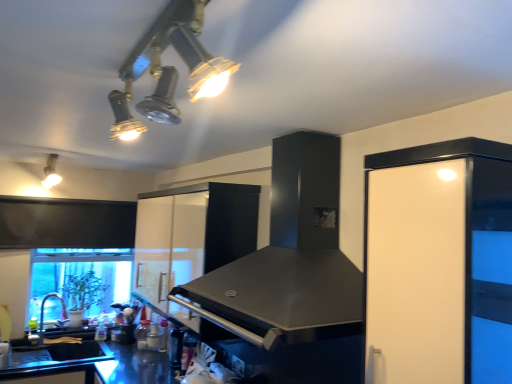
Describe the element at coordinates (42, 311) in the screenshot. I see `brushed metal faucet at lower left` at that location.

At what (x,y) coordinates should I click in order to perform the action: click on metallic track lights at upper center, the 1th light fixture when ordered from front to back. Please return your answer as a coordinate pair (x, y). The image size is (512, 384). Looking at the image, I should click on (168, 68).

I want to click on white glossy cabinet at center, positioned as the second cabinetry in front-to-back order, so click(190, 239).

Describe the element at coordinates (80, 276) in the screenshot. The width and height of the screenshot is (512, 384). I see `transparent glass window screen at lower left` at that location.

Locate an element on the screen. This screenshot has width=512, height=384. black matte sink at lower left is located at coordinates (60, 355).

In terms of width, does black matte sink at lower left look wider or thinner when compared to metallic track lights at upper center, the 1th light fixture when ordered from front to back?

black matte sink at lower left is thinner than metallic track lights at upper center, the 1th light fixture when ordered from front to back.

Looking at this image, considering the sizes of objects black matte sink at lower left and metallic track lights at upper center, which appears as the 1th light fixture when viewed from the right, in the image provided, who is taller, black matte sink at lower left or metallic track lights at upper center, which appears as the 1th light fixture when viewed from the right,?

black matte sink at lower left is taller.

Does black matte sink at lower left have a larger size compared to metallic track lights at upper center, the 1th light fixture when ordered from front to back?

Yes, black matte sink at lower left is bigger than metallic track lights at upper center, the 1th light fixture when ordered from front to back.

How different are the orientations of black matte sink at lower left and metallic track lights at upper center, which appears as the 1th light fixture when viewed from the right, in degrees?

There is a 0.289-degree angle between the facing directions of black matte sink at lower left and metallic track lights at upper center, which appears as the 1th light fixture when viewed from the right.

Is brushed metal faucet at lower left bigger or smaller than metallic track lights at upper center, which appears as the 1th light fixture when viewed from the right?

brushed metal faucet at lower left is bigger than metallic track lights at upper center, which appears as the 1th light fixture when viewed from the right.

Is brushed metal faucet at lower left oriented away from metallic track lights at upper center, the 1th light fixture when ordered from front to back?

No, brushed metal faucet at lower left is not facing the opposite direction of metallic track lights at upper center, the 1th light fixture when ordered from front to back.

Is metallic track lights at upper center, which appears as the 1th light fixture when viewed from the right, surrounded by brushed metal faucet at lower left?

No, metallic track lights at upper center, which appears as the 1th light fixture when viewed from the right, is not surrounded by brushed metal faucet at lower left.

Is the position of transparent glass window screen at lower left less distant than that of black matte sink at lower left?

No, transparent glass window screen at lower left is further to the viewer.

Can you confirm if transparent glass window screen at lower left is wider than black matte sink at lower left?

In fact, transparent glass window screen at lower left might be narrower than black matte sink at lower left.

How different are the orientations of transparent glass window screen at lower left and black matte sink at lower left in degrees?

The facing directions of transparent glass window screen at lower left and black matte sink at lower left are 0.976 degrees apart.

Is transparent glass window screen at lower left taller than black matte sink at lower left?

Yes.

Is metallic track lights at upper center, the second light fixture from the left, completely or partially inside black matte vent at center?

No.

In order to click on vent on the right of the metallic track lights at upper center, which appears as the 1th light fixture when viewed from the right in this screenshot , I will do `click(290, 258)`.

How many degrees apart are the facing directions of black matte vent at center and metallic track lights at upper center, the 1th light fixture when ordered from front to back?

The facing directions of black matte vent at center and metallic track lights at upper center, the 1th light fixture when ordered from front to back, are 89.2 degrees apart.

Is there a large distance between black matte vent at center and metallic track lights at upper center, the 1th light fixture when ordered from front to back?

They are positioned close to each other.

Between white glossy cabinet at center, positioned as the second cabinetry in front-to-back order, and transparent glass window screen at lower left, which one appears on the left side from the viewer's perspective?

From the viewer's perspective, transparent glass window screen at lower left appears more on the left side.

Is white glossy cabinet at center, which ranks as the 2th cabinetry in right-to-left order, thinner than transparent glass window screen at lower left?

No.

Is white glossy cabinet at center, the 1th cabinetry from the back, aimed at transparent glass window screen at lower left?

No.

How much distance is there between white glossy cabinet at center, positioned as the second cabinetry in front-to-back order, and transparent glass window screen at lower left?

A distance of 39.14 inches exists between white glossy cabinet at center, positioned as the second cabinetry in front-to-back order, and transparent glass window screen at lower left.

There is a metallic track lights at upper center, which is counted as the second light fixture, starting from the back. Identify the location of light fixture above it (from a real-world perspective). Image resolution: width=512 pixels, height=384 pixels. (51, 172).

What's the angular difference between matte white light fixture at upper left, arranged as the 1th light fixture when viewed from the left, and metallic track lights at upper center, which appears as the 1th light fixture when viewed from the right,'s facing directions?

The angular difference between matte white light fixture at upper left, arranged as the 1th light fixture when viewed from the left, and metallic track lights at upper center, which appears as the 1th light fixture when viewed from the right, is 0.579 degrees.

Can you confirm if matte white light fixture at upper left, arranged as the 1th light fixture when viewed from the left, is shorter than metallic track lights at upper center, which appears as the 1th light fixture when viewed from the right?

No, matte white light fixture at upper left, arranged as the 1th light fixture when viewed from the left, is not shorter than metallic track lights at upper center, which appears as the 1th light fixture when viewed from the right.

Considering the positions of objects matte white light fixture at upper left, the second light fixture when ordered from right to left, and metallic track lights at upper center, which appears as the 1th light fixture when viewed from the right, in the image provided, who is in front, matte white light fixture at upper left, the second light fixture when ordered from right to left, or metallic track lights at upper center, which appears as the 1th light fixture when viewed from the right,?

Positioned in front is metallic track lights at upper center, which appears as the 1th light fixture when viewed from the right.

Is white glossy cabinet at center, positioned as the second cabinetry in front-to-back order, to the right of black matte vent at center from the viewer's perspective?

Incorrect, white glossy cabinet at center, positioned as the second cabinetry in front-to-back order, is not on the right side of black matte vent at center.

In terms of height, does white glossy cabinet at center, positioned as the second cabinetry in front-to-back order, look taller or shorter compared to black matte vent at center?

Clearly, white glossy cabinet at center, positioned as the second cabinetry in front-to-back order, is taller compared to black matte vent at center.

Is white glossy cabinet at center, the 1th cabinetry from the back, aimed at black matte vent at center?

No, white glossy cabinet at center, the 1th cabinetry from the back, is not turned towards black matte vent at center.

The image size is (512, 384). In order to click on sink behind the metallic track lights at upper center, which is counted as the second light fixture, starting from the back in this screenshot , I will do `click(60, 355)`.

In order to click on faucet on the left of metallic track lights at upper center, the 1th light fixture when ordered from front to back in this screenshot , I will do `click(42, 311)`.

Considering their positions, is white glossy cabinet at right, which is the second cabinetry in left-to-right order, positioned further to matte white light fixture at upper left, arranged as the 1th light fixture when viewed from the left, than brushed metal faucet at lower left?

white glossy cabinet at right, which is the second cabinetry in left-to-right order, is further to matte white light fixture at upper left, arranged as the 1th light fixture when viewed from the left.

Based on their spatial positions, is transparent glass window screen at lower left or white glossy cabinet at center, which ranks as the 2th cabinetry in right-to-left order, closer to black matte vent at center?

white glossy cabinet at center, which ranks as the 2th cabinetry in right-to-left order, is closer to black matte vent at center.

Which object lies nearer to the anchor point transparent glass window screen at lower left, white glossy cabinet at right, which ranks as the 1th cabinetry in front-to-back order, or black matte vent at center?

The object closer to transparent glass window screen at lower left is black matte vent at center.

From the image, which object appears to be nearer to black matte sink at lower left, transparent glass window screen at lower left or black matte vent at center?

The object closer to black matte sink at lower left is transparent glass window screen at lower left.

Which object lies further to the anchor point matte white light fixture at upper left, which appears as the 1th light fixture when viewed from the back, white glossy cabinet at center, the 1th cabinetry from the back, or transparent glass window screen at lower left?

Among the two, white glossy cabinet at center, the 1th cabinetry from the back, is located further to matte white light fixture at upper left, which appears as the 1th light fixture when viewed from the back.

Considering their positions, is transparent glass window screen at lower left positioned closer to white glossy cabinet at center, positioned as the second cabinetry in front-to-back order, than brushed metal faucet at lower left?

Based on the image, transparent glass window screen at lower left appears to be nearer to white glossy cabinet at center, positioned as the second cabinetry in front-to-back order.

Which object lies further to the anchor point black matte sink at lower left, white glossy cabinet at center, which ranks as the 2th cabinetry in right-to-left order, or brushed metal faucet at lower left?

white glossy cabinet at center, which ranks as the 2th cabinetry in right-to-left order, is further to black matte sink at lower left.

Considering their positions, is black matte sink at lower left positioned further to white glossy cabinet at center, positioned as the second cabinetry in front-to-back order, than black matte vent at center?

black matte sink at lower left.

Identify the location of light fixture between white glossy cabinet at right, the first cabinetry from the right, and brushed metal faucet at lower left in the front-back direction. This screenshot has width=512, height=384. (51, 172).

Find the location of a particular element. Image resolution: width=512 pixels, height=384 pixels. cabinetry positioned between white glossy cabinet at right, the second cabinetry in the back-to-front sequence, and transparent glass window screen at lower left from near to far is located at coordinates (190, 239).

Locate an element on the screen. vent located between metallic track lights at upper center, which is counted as the second light fixture, starting from the back, and white glossy cabinet at center, placed as the first cabinetry when sorted from left to right, in the depth direction is located at coordinates (290, 258).

Where is `light fixture between white glossy cabinet at center, which ranks as the 2th cabinetry in right-to-left order, and transparent glass window screen at lower left in the front-back direction`? This screenshot has height=384, width=512. light fixture between white glossy cabinet at center, which ranks as the 2th cabinetry in right-to-left order, and transparent glass window screen at lower left in the front-back direction is located at coordinates tap(51, 172).